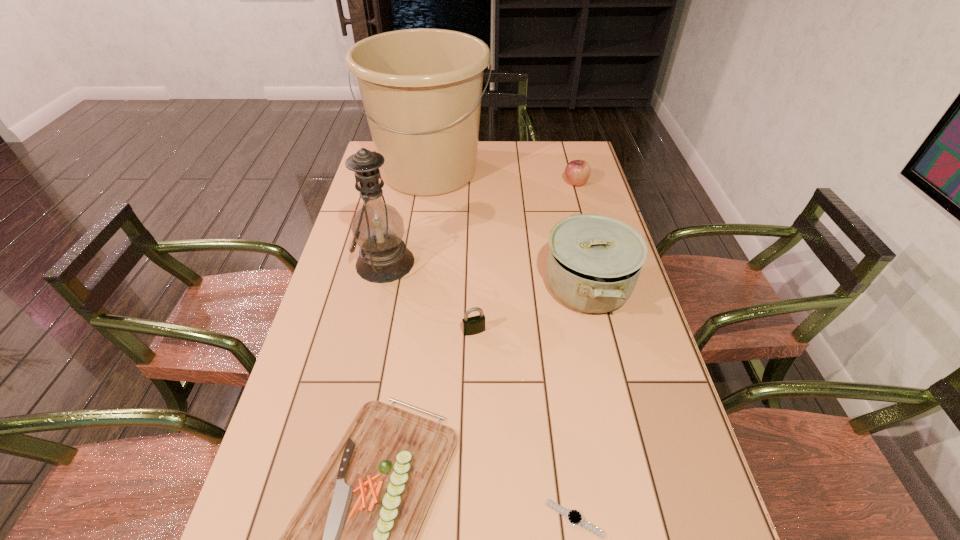
Image resolution: width=960 pixels, height=540 pixels. I want to click on vacant region at the far right corner of the desktop, so click(x=568, y=152).

Where is `free space between the third shortest object and the apple`? free space between the third shortest object and the apple is located at coordinates (525, 257).

Where is `vacant area between the third shortest object and the fourth shortest object`? Image resolution: width=960 pixels, height=540 pixels. vacant area between the third shortest object and the fourth shortest object is located at coordinates (525, 257).

Find the location of a particular element. free area in between the second tallest object and the third shortest object is located at coordinates (429, 297).

Locate an element on the screen. The width and height of the screenshot is (960, 540). empty location between the bucket and the apple is located at coordinates (502, 177).

Find the location of a particular element. free spot between the saucepan and the sixth shortest object is located at coordinates (486, 274).

Image resolution: width=960 pixels, height=540 pixels. Find the location of `free space that is in between the bucket and the fifth shortest object`. free space that is in between the bucket and the fifth shortest object is located at coordinates (508, 228).

Find the location of a particular element. Image resolution: width=960 pixels, height=540 pixels. vacant area that lies between the shortest object and the fourth tallest object is located at coordinates (x=575, y=351).

Identify which object is the third nearest to the fourth tallest object. Please provide its 2D coordinates. Your answer should be formatted as a tuple, i.e. [(x, y)], where the tuple contains the x and y coordinates of a point satisfying the conditions above.

[(377, 227)]

Choose which object is the fourth nearest neighbor to the apple. Please provide its 2D coordinates. Your answer should be formatted as a tuple, i.e. [(x, y)], where the tuple contains the x and y coordinates of a point satisfying the conditions above.

[(473, 325)]